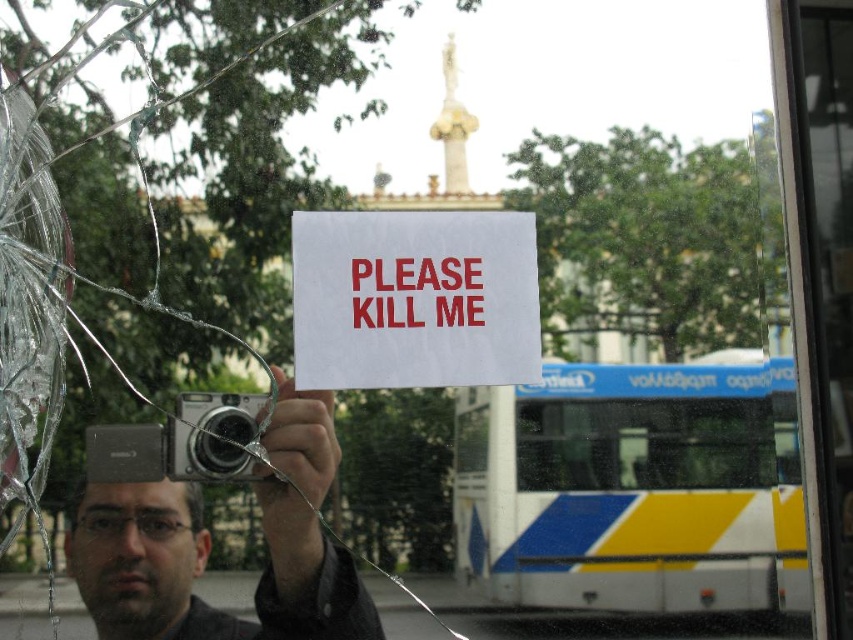
Question: Observing the image, what is the correct spatial positioning of white plastic bus at lower right in reference to matte silver camera at center?

Choices:
 (A) above
 (B) below

Answer: (A)

Question: Which is farther from the matte silver camera at center?

Choices:
 (A) white plastic bus at lower right
 (B) white paper sign at center

Answer: (A)

Question: Does white paper sign at center appear on the left side of matte silver camera at center?

Choices:
 (A) yes
 (B) no

Answer: (B)

Question: Is white plastic bus at lower right closer to camera compared to matte silver camera at center?

Choices:
 (A) no
 (B) yes

Answer: (A)

Question: Among these points, which one is nearest to the camera?

Choices:
 (A) (479, 273)
 (B) (181, 512)

Answer: (B)

Question: Which of these objects is positioned farthest from the white paper sign at center?

Choices:
 (A) white plastic bus at lower right
 (B) matte silver camera at center

Answer: (B)